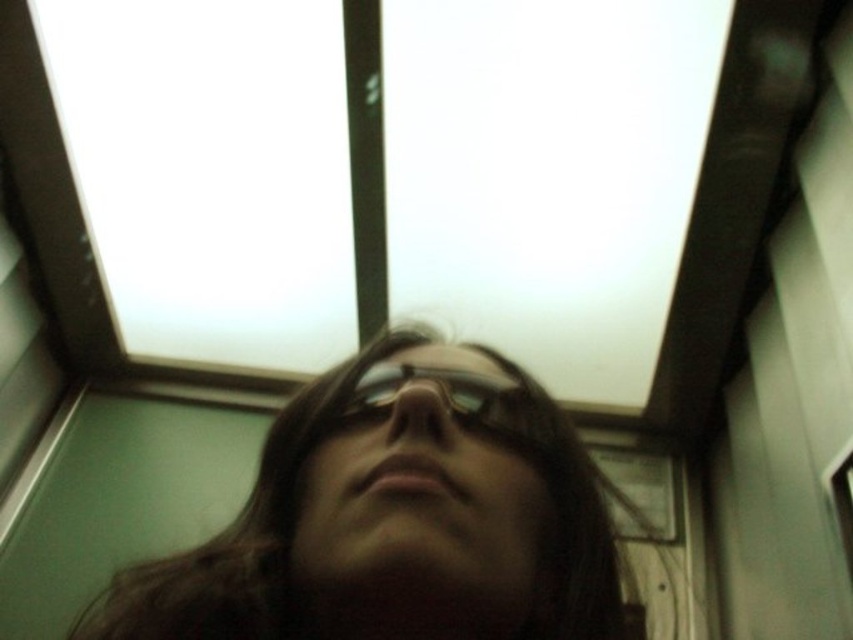
You are standing in a public space and looking up at the ceiling. There is a point at coordinates point (535, 588). If you want to reach that point with a 20 inch long stick, will you be able to reach it?

The distance of point (535, 588) from camera is 19.88 inches, so yes, the 20 inch long stick will be sufficient to reach it.

You are taking a photo of the ceiling and notice the matte black hair at center and the black reflective glasses at center in your shot. Which object is closer to your camera lens?

The matte black hair at center is closer to the viewer than the black reflective glasses at center, so the matte black hair at center would be closer to your camera lens.

You are taking a photo of the ceiling from a low angle. There are two points marked in the image. The first point is at coordinates point [503,573] and the second is at point [531,410]. Which point is closer to your camera?

Point [503,573] is closer to the camera than point [531,410].